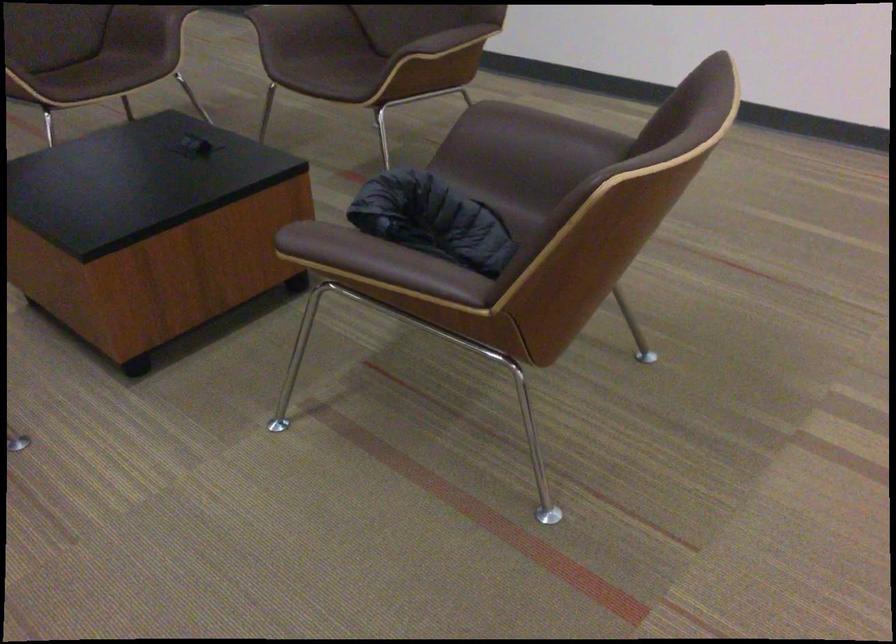
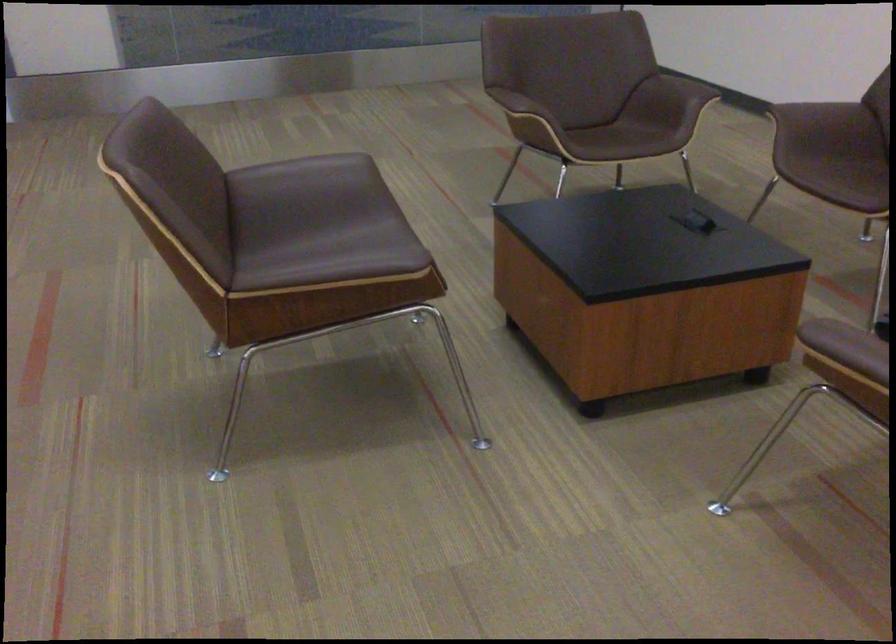
Question: The camera is either moving clockwise (left) or counter-clockwise (right) around the object. The first image is from the beginning of the video and the second image is from the end. Is the camera moving left or right when shooting the video?

Choices:
 (A) Left
 (B) Right

Answer: (B)